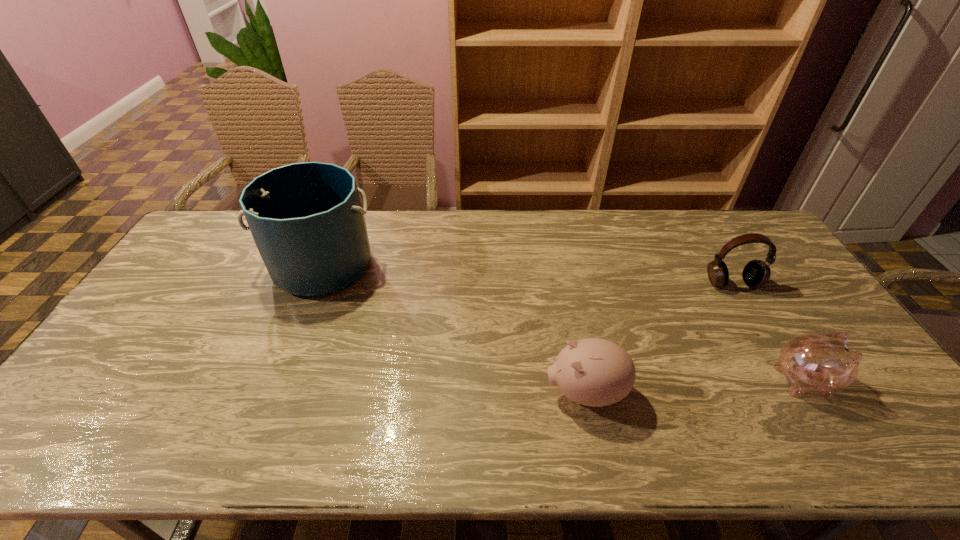
The image size is (960, 540). I want to click on vacant point located between the headset and the right piggy bank, so click(768, 332).

Where is `free space between the second object from left to right and the headset`? The width and height of the screenshot is (960, 540). free space between the second object from left to right and the headset is located at coordinates (659, 338).

In order to click on empty space that is in between the right piggy bank and the left piggy bank in this screenshot , I will do `click(695, 387)`.

Locate an element on the screen. The image size is (960, 540). free space between the headset and the right piggy bank is located at coordinates (768, 332).

Locate an element on the screen. Image resolution: width=960 pixels, height=540 pixels. vacant area that lies between the second object from left to right and the right piggy bank is located at coordinates (695, 387).

The width and height of the screenshot is (960, 540). I want to click on free space between the right piggy bank and the left piggy bank, so click(x=695, y=387).

You are a GUI agent. You are given a task and a screenshot of the screen. Output one action in this format:
    pyautogui.click(x=<x>, y=<y>)
    Task: Click on the vacant space in between the bucket and the left piggy bank
    
    Given the screenshot: What is the action you would take?
    pyautogui.click(x=453, y=329)

Locate an element on the screen. The image size is (960, 540). object that stands as the closest to the right piggy bank is located at coordinates (756, 273).

Select which object appears as the closest to the right piggy bank. Please provide its 2D coordinates. Your answer should be formatted as a tuple, i.e. [(x, y)], where the tuple contains the x and y coordinates of a point satisfying the conditions above.

[(756, 273)]

Where is `vacant region that satisfies the following two spatial constraints: 1. on the front facing side of the right piggy bank; 2. on the ear pads of the headset`? Image resolution: width=960 pixels, height=540 pixels. vacant region that satisfies the following two spatial constraints: 1. on the front facing side of the right piggy bank; 2. on the ear pads of the headset is located at coordinates (743, 283).